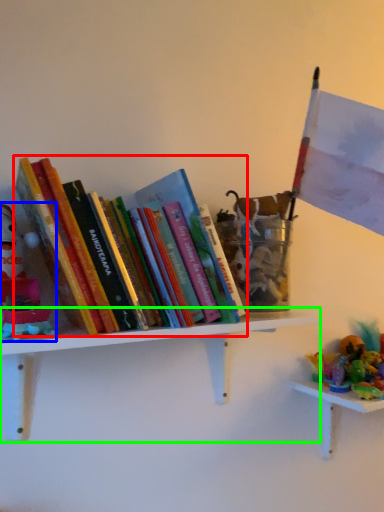
Question: Estimate the real-world distances between objects in this image. Which object is farther from book (highlighted by a red box), toy (highlighted by a blue box) or shelf (highlighted by a green box)?

Choices:
 (A) toy
 (B) shelf

Answer: (B)